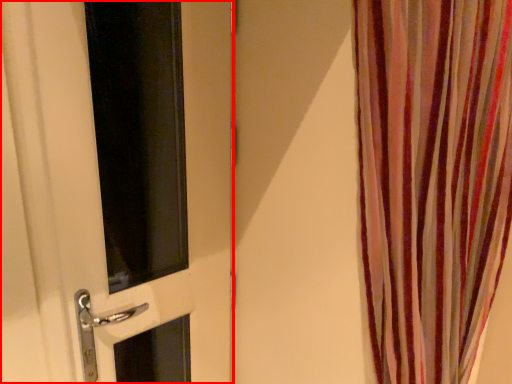
Question: From the image's perspective, what is the correct spatial positioning of door (annotated by the red box) in reference to curtain?

Choices:
 (A) below
 (B) above

Answer: (B)